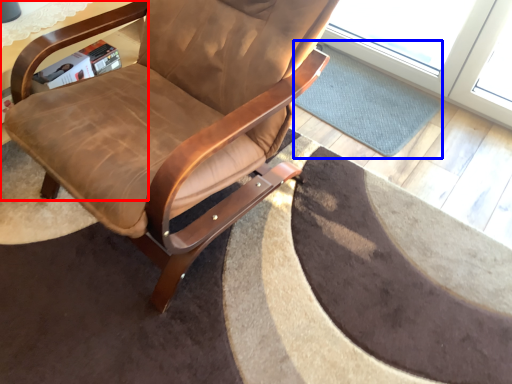
Question: Which point is further to the camera, table (highlighted by a red box) or mat (highlighted by a blue box)?

Choices:
 (A) table
 (B) mat

Answer: (B)